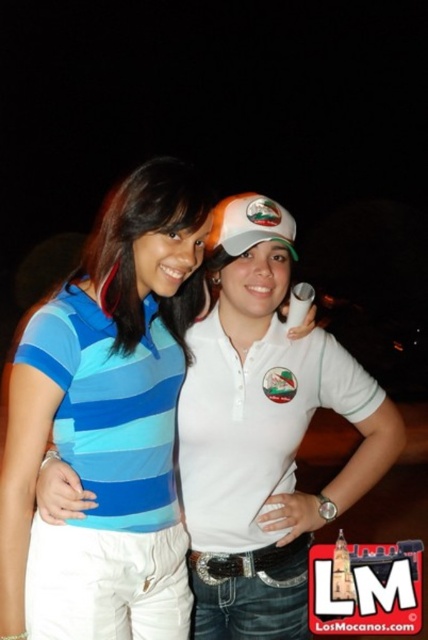
Question: Which object is the closest to the blue striped polo shirt at center?

Choices:
 (A) white matte polo shirt at center
 (B) white matte baseball cap at center
 (C) blue striped shirt at center
 (D) blue striped polo shirt at left

Answer: (A)

Question: Which point is closer to the camera?

Choices:
 (A) white matte baseball cap at center
 (B) blue striped shirt at center
 (C) blue striped polo shirt at center

Answer: (B)

Question: Does white matte polo shirt at center have a greater width compared to blue striped polo shirt at left?

Choices:
 (A) yes
 (B) no

Answer: (A)

Question: Which object is farther from the camera taking this photo?

Choices:
 (A) blue striped polo shirt at center
 (B) white matte baseball cap at center
 (C) white matte polo shirt at center
 (D) blue striped polo shirt at left

Answer: (A)

Question: Observing the image, what is the correct spatial positioning of white matte polo shirt at center in reference to blue striped polo shirt at left?

Choices:
 (A) right
 (B) left

Answer: (A)

Question: Is blue striped polo shirt at left below white matte baseball cap at center?

Choices:
 (A) no
 (B) yes

Answer: (B)